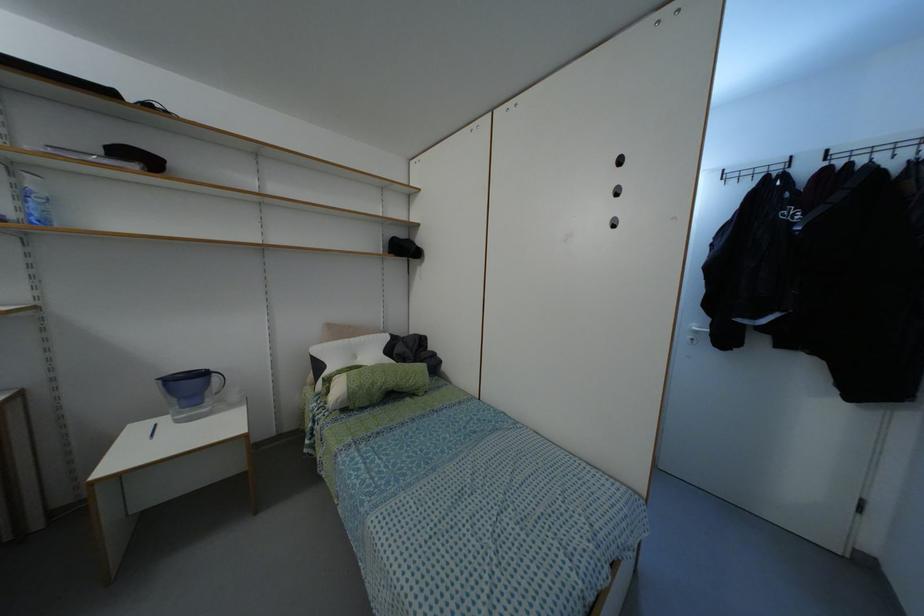
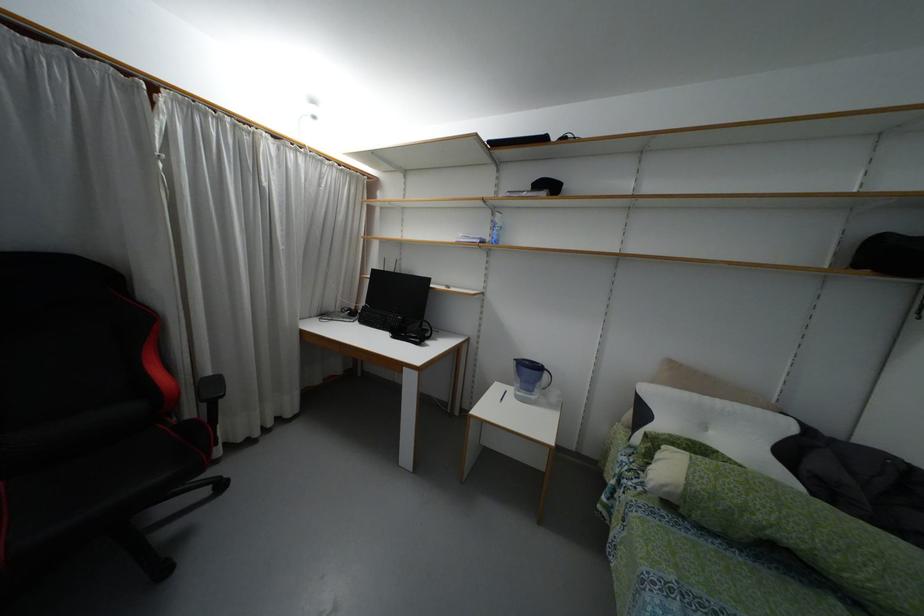
Where in the second image is the point corresponding to (214,378) from the first image?

(544, 375)